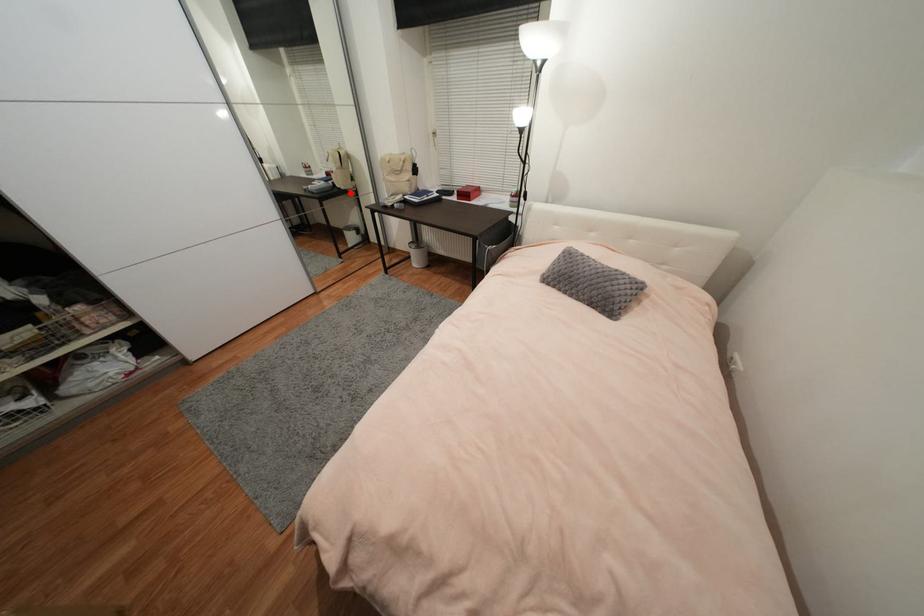
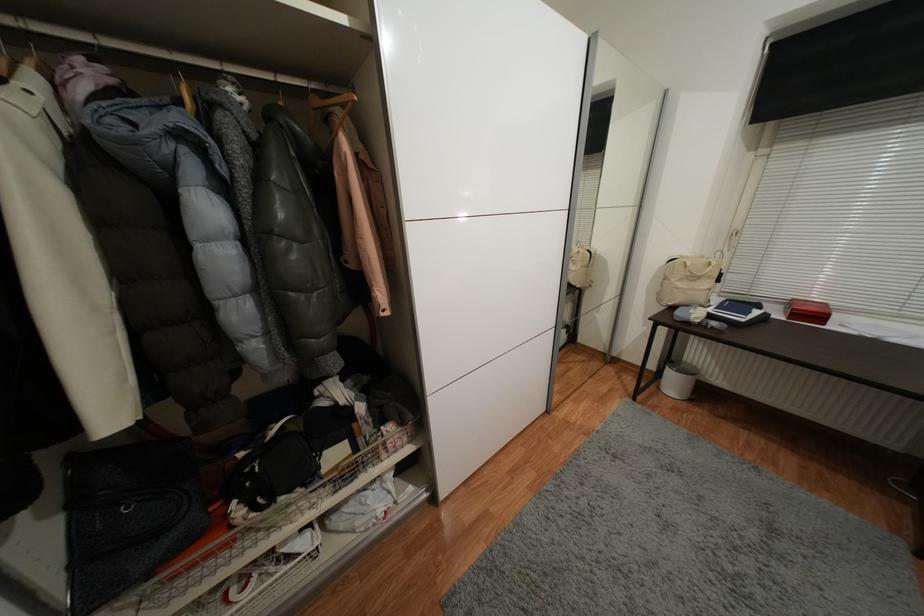
Question: A red point is marked in image1. In image2, is the corresponding 3D point closer to the camera or farther? Reply with the corresponding letter.

Choices:
 (A) The corresponding 3D point is closer.
 (B) The corresponding 3D point is farther.

Answer: (B)